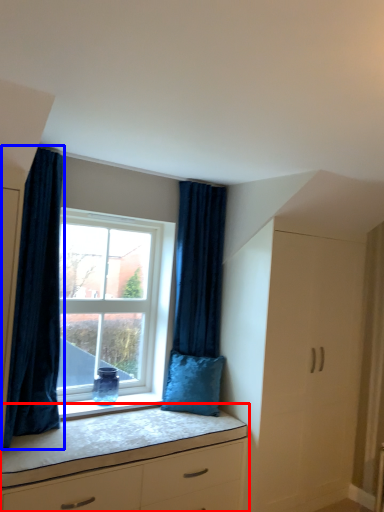
Question: Which object is closer to the camera taking this photo, chest of drawers (highlighted by a red box) or curtain (highlighted by a blue box)?

Choices:
 (A) chest of drawers
 (B) curtain

Answer: (A)